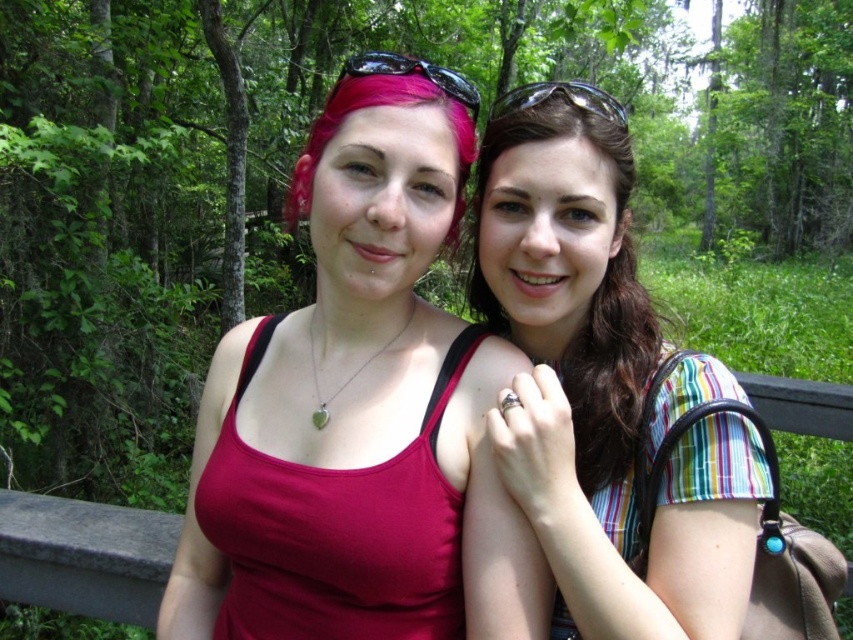
You are standing in a forest and want to take a photo of the point at coordinates point (372, 68). Your camera has a focal length of 50mm and a sensor size of 24mm x 36mm. What is the minimum distance you need to move forward to ensure the point fills the frame vertically?

The point at coordinates point (372, 68) is 37.91 inches away from the camera. To calculate the minimum distance needed to move forward, use the formula for field of view. The vertical field of view is 2 arctan. The required distance would be the current distance minus the calculated distance needed to fit the point within the sensor dimensions. However, since the point is a single coordinate, it cannot fill the frame vertically. Therefore, it is not possible to fill the frame with just a point.

You are a photographer trying to capture a closeup of the clear plastic goggles at upper center without including the striped fabric shirt at right in the frame. Given their sizes, is this possible?

The striped fabric shirt at right is bigger than clear plastic goggles at upper center, so it might be challenging to frame the goggles without including the shirt if they are positioned closely. Adjust your angle or zoom in to focus solely on the goggles.